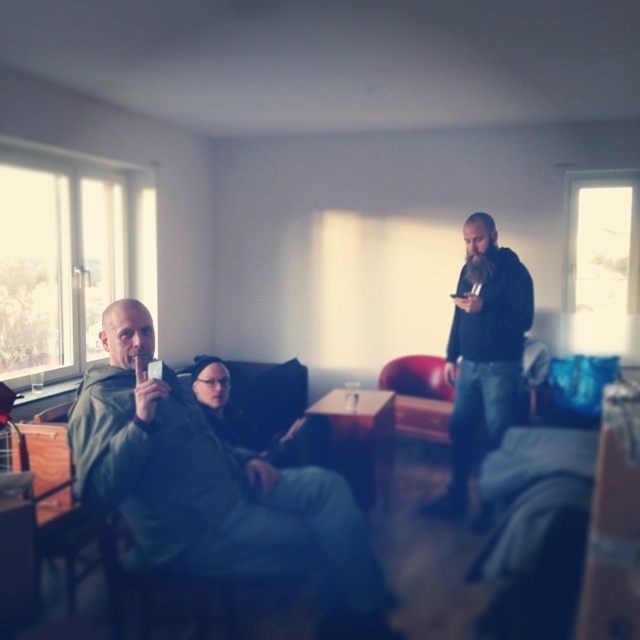
Can you confirm if green matte jacket at left is smaller than black matte jacket at right?

Incorrect, green matte jacket at left is not smaller in size than black matte jacket at right.

Is green matte jacket at left above black matte jacket at right?

Actually, green matte jacket at left is below black matte jacket at right.

Is point (237, 464) behind point (464, 413)?

No.

The image size is (640, 640). What are the coordinates of `green matte jacket at left` in the screenshot? It's located at (211, 484).